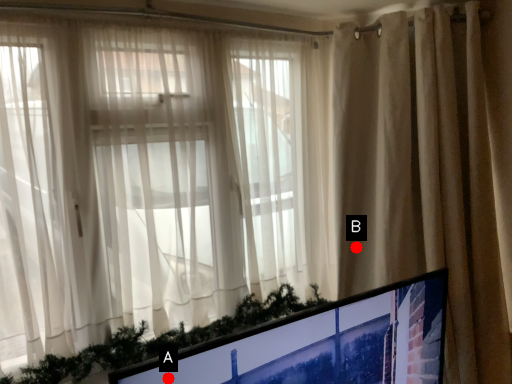
Question: Two points are circled on the image, labeled by A and B beside each circle. Which point is closer to the camera taking this photo?

Choices:
 (A) A is closer
 (B) B is closer

Answer: (A)